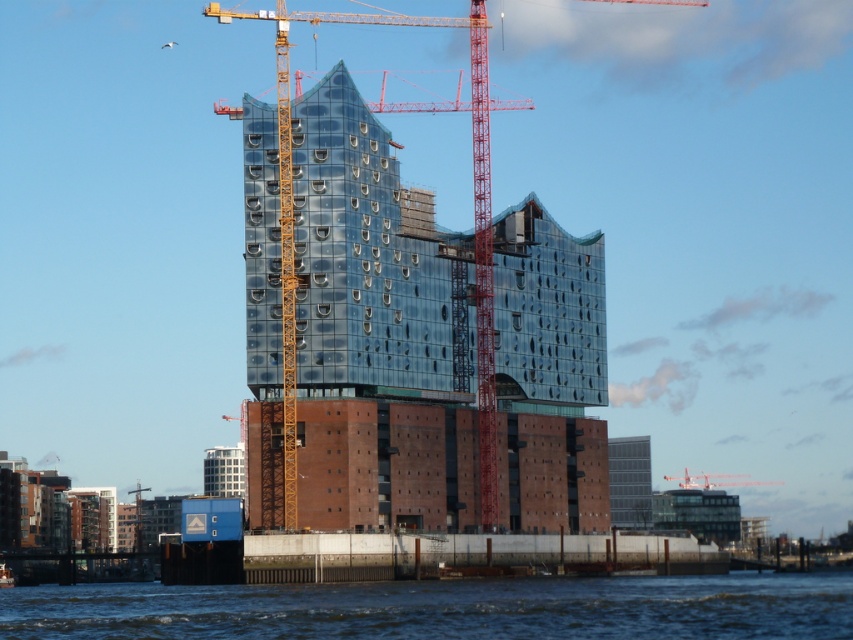
You are standing in front of the construction site and want to determine the relative positions of two points marked on the building. Which of the two points, point (585, 580) or point (708, 477), is closer to you?

Point (585, 580) is closer to the camera than point (708, 477).

You are a construction worker needing to move a heavy beam from the left side of the building to the right side. Which crane, the yellow metal crane at center or the metallic red crane at center, would be better positioned to handle this task?

The yellow metal crane at center is to the left of metallic red crane at center, so the yellow metal crane at center is better positioned to handle moving the beam from the left side to the right side since it is already positioned closer to the starting point on the left.